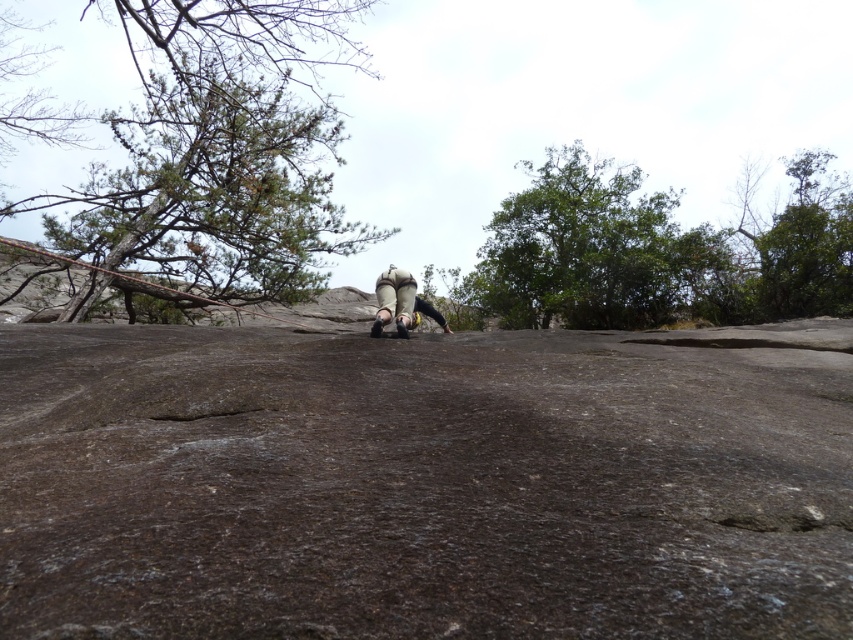
Can you confirm if green leafy tree at upper center is positioned to the right of matte gray climbing shoes at center?

Indeed, green leafy tree at upper center is positioned on the right side of matte gray climbing shoes at center.

Does green leafy tree at upper center appear over matte gray climbing shoes at center?

Yes, green leafy tree at upper center is above matte gray climbing shoes at center.

Is point (554, 157) farther from viewer compared to point (410, 275)?

Yes, point (554, 157) is farther from viewer.

Where is `green leafy tree at upper center`? The image size is (853, 640). green leafy tree at upper center is located at coordinates (596, 252).

Can you confirm if green textured tree at upper left is positioned above green leafy tree at upper right?

No.

In the scene shown: Is green textured tree at upper left to the right of green leafy tree at upper right from the viewer's perspective?

Incorrect, green textured tree at upper left is not on the right side of green leafy tree at upper right.

Where is `green textured tree at upper left`? green textured tree at upper left is located at coordinates (210, 193).

Does green textured tree at upper left have a larger size compared to matte gray climbing shoes at center?

Yes.

Is green textured tree at upper left to the left of matte gray climbing shoes at center from the viewer's perspective?

Yes, green textured tree at upper left is to the left of matte gray climbing shoes at center.

Between point (132, 172) and point (409, 275), which one is positioned in front?

Point (409, 275) is in front.

Where is `green textured tree at upper left`? This screenshot has width=853, height=640. green textured tree at upper left is located at coordinates (210, 193).